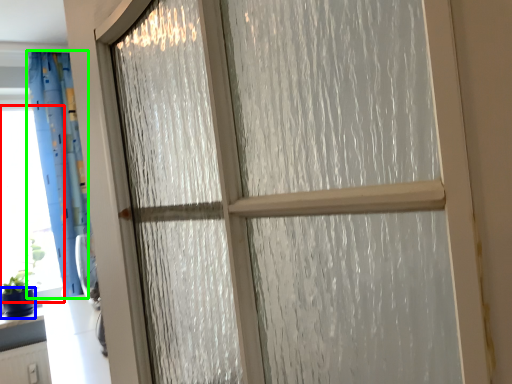
Question: Estimate the real-world distances between objects in this image. Which object is closer to window screen (highlighted by a red box), glass vase (highlighted by a blue box) or curtain (highlighted by a green box)?

Choices:
 (A) glass vase
 (B) curtain

Answer: (B)